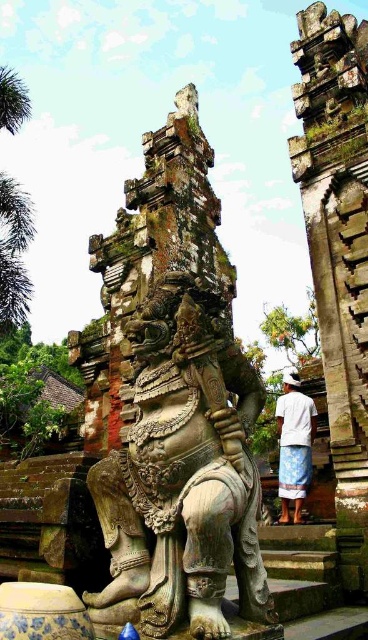
Can you confirm if carved stone pillar at right is bigger than green leafy palm tree at left?

Actually, carved stone pillar at right might be smaller than green leafy palm tree at left.

Is point (334, 436) in front of point (8, 275)?

Yes.

Locate an element on the screen. The image size is (368, 640). carved stone pillar at right is located at coordinates (337, 250).

Is carved stone pillar at right wider than green leafy palm tree at upper left?

Incorrect, carved stone pillar at right's width does not surpass green leafy palm tree at upper left's.

Between carved stone pillar at right and green leafy palm tree at upper left, which one is positioned lower?

Positioned lower is carved stone pillar at right.

Who is more forward, (334, 497) or (1, 68)?

Point (334, 497) is in front.

This screenshot has height=640, width=368. In order to click on carved stone pillar at right in this screenshot , I will do point(337,250).

Between point (160, 378) and point (12, 83), which one is positioned behind?

Point (12, 83)

Is carved stone statue at center positioned in front of green leafy palm tree at upper left?

Yes, carved stone statue at center is in front of green leafy palm tree at upper left.

Describe the element at coordinates (177, 403) in the screenshot. I see `carved stone statue at center` at that location.

Image resolution: width=368 pixels, height=640 pixels. What are the coordinates of `carved stone statue at center` in the screenshot? It's located at (177, 403).